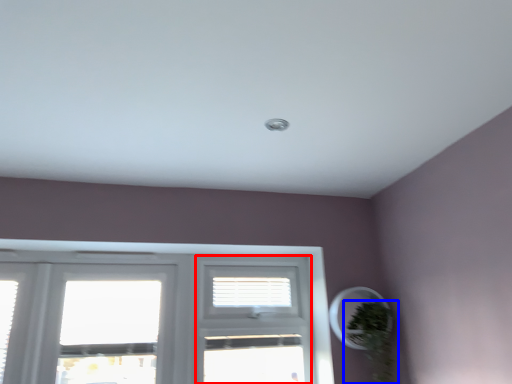
Question: Which object is further to the camera taking this photo, screen door (highlighted by a red box) or houseplant (highlighted by a blue box)?

Choices:
 (A) screen door
 (B) houseplant

Answer: (A)